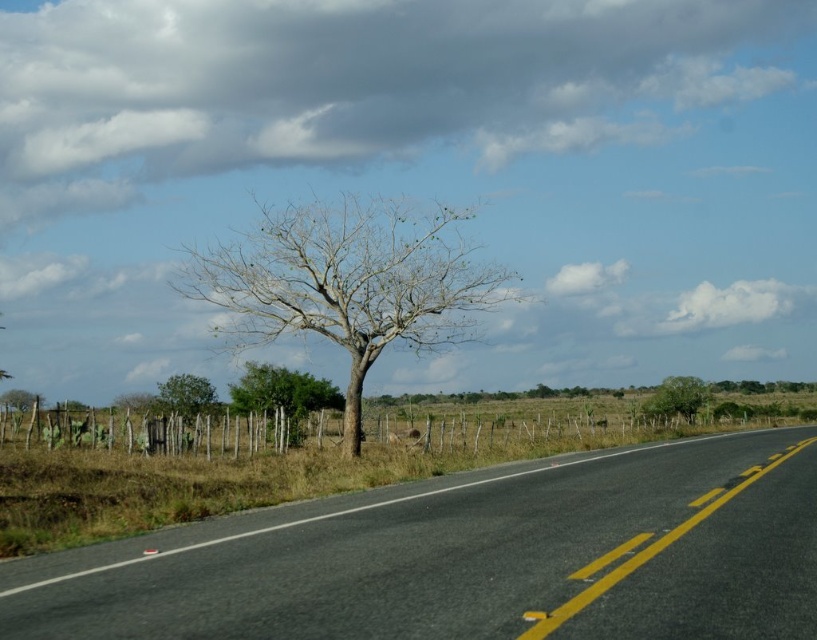
You are a hiker standing on the road and want to reach the green leafy tree at center. Which direction should you walk to get closer to it while avoiding the bare wood tree at left?

The green leafy tree at center is closer to the viewer than the bare wood tree at left. To reach the green leafy tree at center while avoiding the bare wood tree at left, walk towards the center of the road away from the bare wood tree at left.